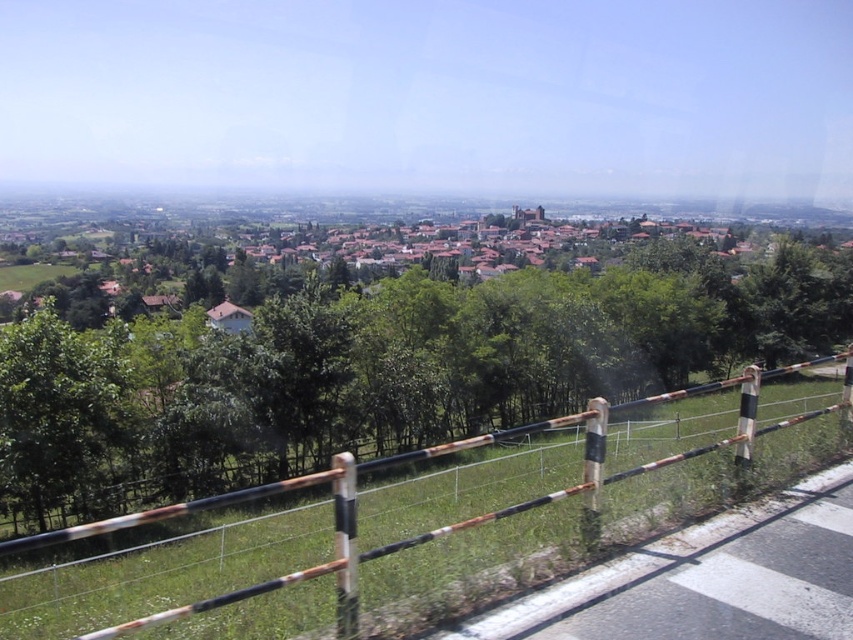
You are a landscape architect designing a new park. You need to place a new bench between the green leafy tree at center and the rusty metal fence at lower right. Which object should the bench be closer to if you want it to be proportionally balanced with their sizes?

The bench should be closer to the rusty metal fence at lower right because the green leafy tree at center is larger in size than the rusty metal fence at lower right, so balancing their sizes would require placing the bench nearer to the smaller object.

You are a hiker standing on a trail and see the green leafy tree at center and the rusty metal fence at lower right. Which object is closer to you?

The green leafy tree at center is closer to you than the rusty metal fence at lower right because it is positioned further to the viewer.